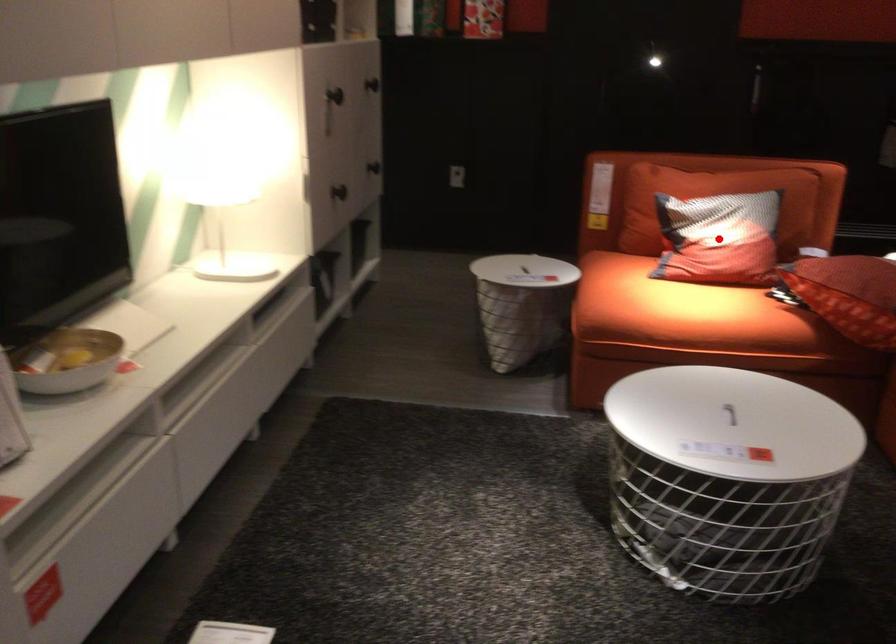
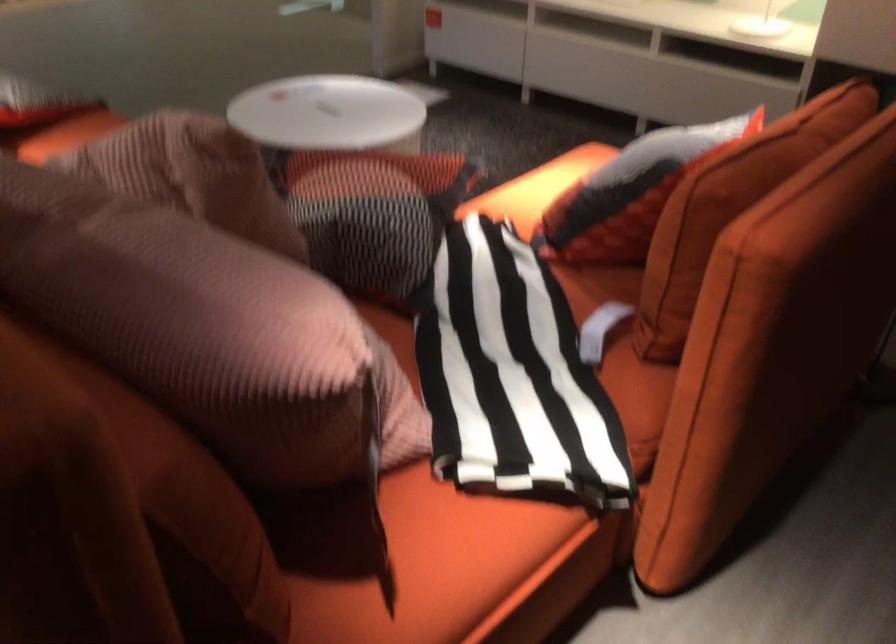
Question: I am providing you with two images of the same scene from different viewpoints. A red point is marked on the first image. Is the red point's position out of view in image 2?

Choices:
 (A) Yes
 (B) No

Answer: (A)